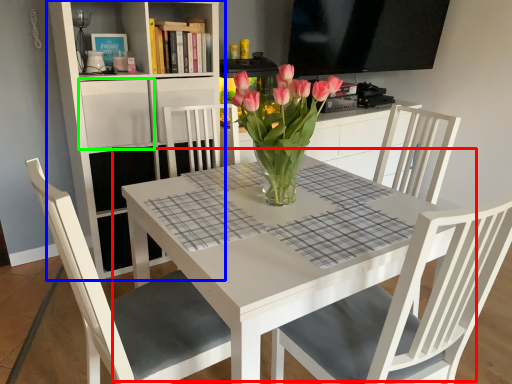
Question: Based on their relative distances, which object is farther from table (highlighted by a red box)? Choose from shelf (highlighted by a blue box) and shelf (highlighted by a green box).

Choices:
 (A) shelf
 (B) shelf

Answer: (B)